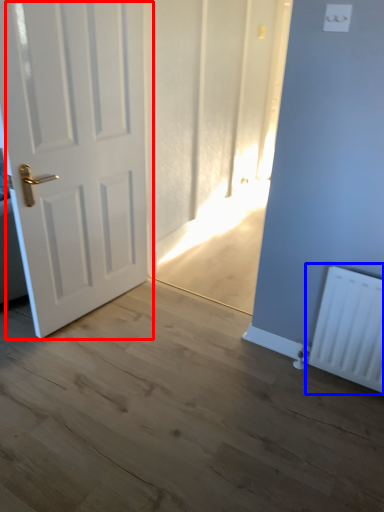
Question: Which point is further to the camera, door (highlighted by a red box) or radiator (highlighted by a blue box)?

Choices:
 (A) door
 (B) radiator

Answer: (B)